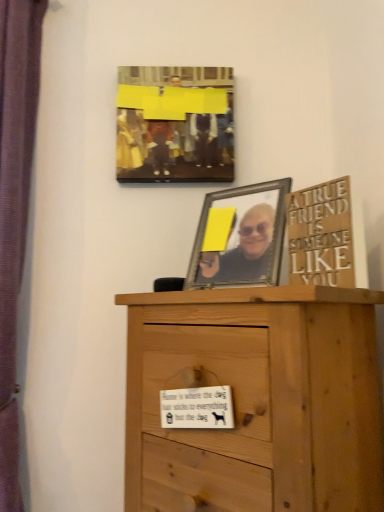
In the scene shown: What is the approximate width of wooden sign at upper right?

The width of wooden sign at upper right is 3.08 centimeters.

Find the location of a particular element. This screenshot has width=384, height=512. matte yellow canvas at upper center is located at coordinates (175, 124).

Locate an element on the screen. The width and height of the screenshot is (384, 512). picture frame above the wooden sign at upper right (from the image's perspective) is located at coordinates (175, 124).

From a real-world perspective, is wooden sign at upper right physically located above or below matte yellow canvas at upper center?

→ wooden sign at upper right is situated lower than matte yellow canvas at upper center in the real world.

Is wooden sign at upper right positioned before matte yellow canvas at upper center?

Yes, the depth of wooden sign at upper right is less than that of matte yellow canvas at upper center.

How many degrees apart are the facing directions of wooden sign at upper right and matte yellow canvas at upper center?

58.7 degrees separate the facing orientations of wooden sign at upper right and matte yellow canvas at upper center.

Considering the points (294, 272) and (3, 466), which point is in front, point (294, 272) or point (3, 466)?

Positioned in front is point (294, 272).

Is wooden sign at upper right oriented towards purple fabric curtain at left?

No, wooden sign at upper right is not turned towards purple fabric curtain at left.

Considering the sizes of objects wooden sign at upper right and purple fabric curtain at left in the image provided, who is smaller, wooden sign at upper right or purple fabric curtain at left?

wooden sign at upper right.

From a real-world perspective, is wooden sign at upper right above or below purple fabric curtain at left?

Clearly, from a real-world perspective, wooden sign at upper right is below purple fabric curtain at left.

From a real-world perspective, which is physically below, matte yellow canvas at upper center or wooden sign at upper right?

In real-world perspective, wooden sign at upper right is lower.

Is matte yellow canvas at upper center taller than wooden sign at upper right?

Indeed, matte yellow canvas at upper center has a greater height compared to wooden sign at upper right.

Measure the distance from matte yellow canvas at upper center to wooden sign at upper right.

matte yellow canvas at upper center is 49.68 centimeters away from wooden sign at upper right.

Considering the sizes of matte yellow canvas at upper center and wooden sign at upper right in the image, is matte yellow canvas at upper center wider or thinner than wooden sign at upper right?

matte yellow canvas at upper center is wider than wooden sign at upper right.

Between purple fabric curtain at left and matte yellow canvas at upper center, which one has larger width?

purple fabric curtain at left.

Which is in front, point (13, 48) or point (200, 176)?

Point (13, 48)

Are purple fabric curtain at left and matte yellow canvas at upper center far apart?

No, purple fabric curtain at left is not far away from matte yellow canvas at upper center.

Is light brown wood chest of drawers at center looking in the opposite direction of wooden sign at upper right?

light brown wood chest of drawers at center does not have its back to wooden sign at upper right.

In the scene shown: Is light brown wood chest of drawers at center far from wooden sign at upper right?

They are positioned close to each other.

Is point (164, 431) closer or farther from the camera than point (351, 253)?

Clearly, point (164, 431) is more distant from the camera than point (351, 253).

Considering the relative sizes of purple fabric curtain at left and light brown wood chest of drawers at center in the image provided, is purple fabric curtain at left wider than light brown wood chest of drawers at center?

Incorrect, the width of purple fabric curtain at left does not surpass that of light brown wood chest of drawers at center.

In the scene shown: Can you tell me how much purple fabric curtain at left and light brown wood chest of drawers at center differ in facing direction?

The angle between the facing direction of purple fabric curtain at left and the facing direction of light brown wood chest of drawers at center is 45.3 degrees.

Is purple fabric curtain at left smaller than light brown wood chest of drawers at center?

Yes.

From the image's perspective, is purple fabric curtain at left above or below light brown wood chest of drawers at center?

Based on their image positions, purple fabric curtain at left is located above light brown wood chest of drawers at center.

Measure the distance between matte yellow canvas at upper center and purple fabric curtain at left.

matte yellow canvas at upper center and purple fabric curtain at left are 16.80 inches apart from each other.

Where is `picture frame lying on the right of purple fabric curtain at left`? picture frame lying on the right of purple fabric curtain at left is located at coordinates (175, 124).

From a real-world perspective, is matte yellow canvas at upper center above or below purple fabric curtain at left?

→ From a real-world perspective, matte yellow canvas at upper center is physically above purple fabric curtain at left.

Is point (123, 168) more distant than point (24, 71)?

Yes, it is.

Find the location of `picture frame that is above the wooden sign at upper right (from a real-world perspective)`. picture frame that is above the wooden sign at upper right (from a real-world perspective) is located at coordinates (175, 124).

This screenshot has height=512, width=384. What are the coordinates of `writing located on the right of purple fabric curtain at left` in the screenshot? It's located at (321, 234).

From the image, which object appears to be nearer to purple fabric curtain at left, wooden sign at upper right or matte yellow canvas at upper center?

Among the two, matte yellow canvas at upper center is located nearer to purple fabric curtain at left.

Estimate the real-world distances between objects in this image. Which object is further from purple fabric curtain at left, light brown wood chest of drawers at center or matte yellow canvas at upper center?

Among the two, light brown wood chest of drawers at center is located further to purple fabric curtain at left.

Considering their positions, is matte yellow canvas at upper center positioned closer to purple fabric curtain at left than wooden sign at upper right?

The object closer to purple fabric curtain at left is matte yellow canvas at upper center.

Based on their spatial positions, is light brown wood chest of drawers at center or purple fabric curtain at left closer to wooden sign at upper right?

Among the two, light brown wood chest of drawers at center is located nearer to wooden sign at upper right.

Based on the photo, estimate the real-world distances between objects in this image. Which object is closer to matte yellow canvas at upper center, light brown wood chest of drawers at center or wooden sign at upper right?

The object closer to matte yellow canvas at upper center is wooden sign at upper right.

Looking at this image, from the image, which object appears to be nearer to light brown wood chest of drawers at center, matte yellow canvas at upper center or wooden sign at upper right?

wooden sign at upper right is closer to light brown wood chest of drawers at center.

From the image, which object appears to be nearer to light brown wood chest of drawers at center, purple fabric curtain at left or matte yellow canvas at upper center?

matte yellow canvas at upper center.

Which object lies further to the anchor point matte yellow canvas at upper center, wooden sign at upper right or light brown wood chest of drawers at center?

Among the two, light brown wood chest of drawers at center is located further to matte yellow canvas at upper center.

The image size is (384, 512). I want to click on curtain that lies between matte yellow canvas at upper center and light brown wood chest of drawers at center from top to bottom, so click(15, 207).

Locate an element on the screen. Image resolution: width=384 pixels, height=512 pixels. picture frame between purple fabric curtain at left and wooden sign at upper right is located at coordinates (175, 124).

Locate an element on the screen. Image resolution: width=384 pixels, height=512 pixels. chest of drawers between purple fabric curtain at left and wooden sign at upper right is located at coordinates (259, 398).

What are the coordinates of `writing between matte yellow canvas at upper center and light brown wood chest of drawers at center vertically` in the screenshot? It's located at (321, 234).